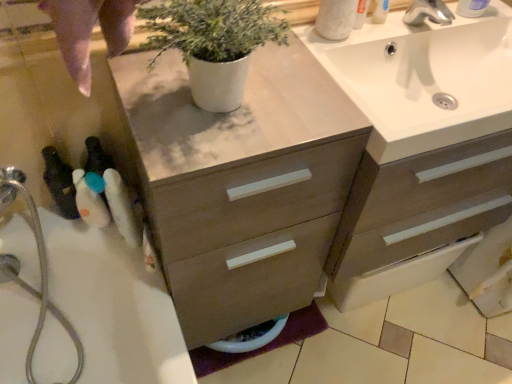
Identify the location of vacant space underneath white glossy pot at center (from a real-world perspective). The height and width of the screenshot is (384, 512). point(226,112).